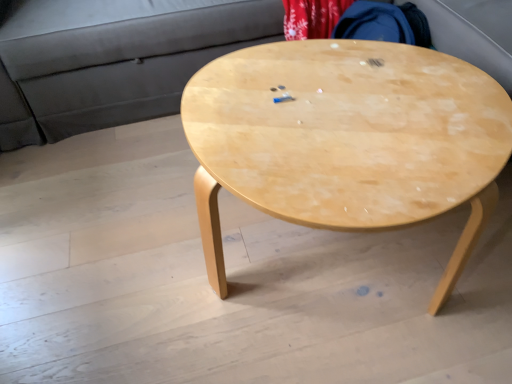
You are a GUI agent. You are given a task and a screenshot of the screen. Output one action in this format:
    pyautogui.click(x=<x>, y=<y>)
    Task: Click on the vacant space situated above light wood/texture coffee table at center (from a real-world perspective)
    
    Given the screenshot: What is the action you would take?
    pyautogui.click(x=352, y=108)